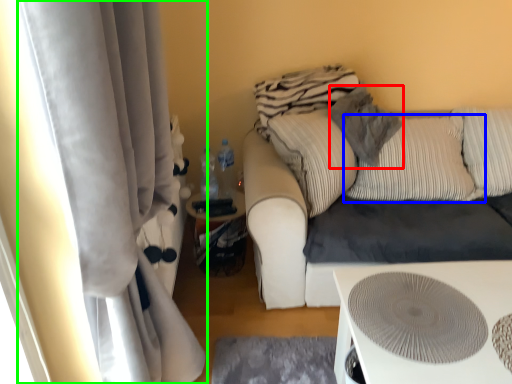
Question: Which object is positioned farthest from pillow (highlighted by a red box)? Select from pillow (highlighted by a blue box) and curtain (highlighted by a green box).

Choices:
 (A) pillow
 (B) curtain

Answer: (B)